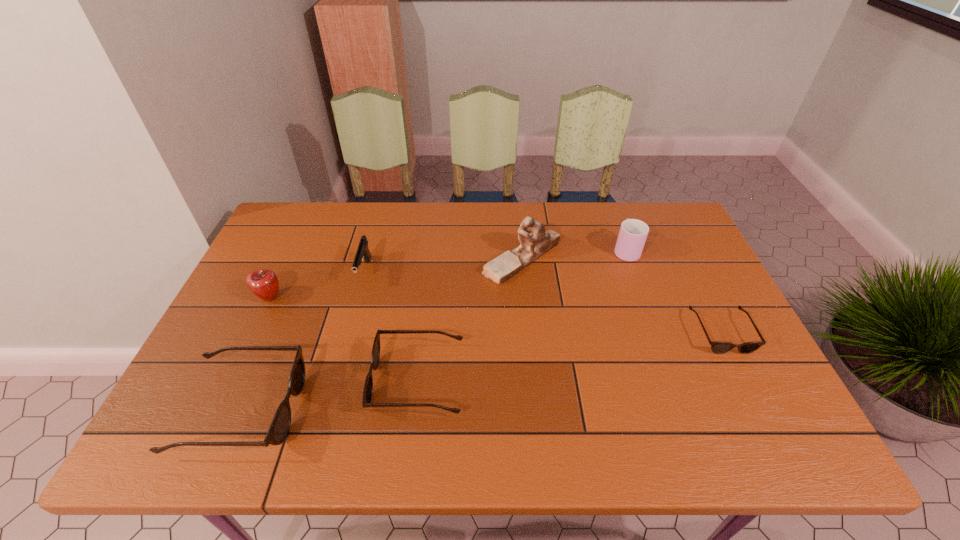
In order to click on free location located 0.150m on the front lenses of the leftmost sunglasses in this screenshot , I will do [364, 409].

Where is `free point located on the front lenses of the sixth tallest object`? free point located on the front lenses of the sixth tallest object is located at coordinates (279, 381).

You are a GUI agent. You are given a task and a screenshot of the screen. Output one action in this format:
    pyautogui.click(x=<x>, y=<y>)
    Task: Click on the free space located on the front lenses of the sixth tallest object
    
    Given the screenshot: What is the action you would take?
    pyautogui.click(x=212, y=381)

This screenshot has width=960, height=540. Identify the location of vacant space located 0.120m on the front lenses of the sixth tallest object. (323, 381).

The image size is (960, 540). What are the coordinates of `free location located 0.060m on the front lenses of the rightmost sunglasses` in the screenshot? It's located at (742, 375).

This screenshot has width=960, height=540. Identify the location of free space located 0.150m on the front-facing side of the figurine. (433, 258).

The height and width of the screenshot is (540, 960). Find the location of `free space located 0.230m on the front-facing side of the figurine`. free space located 0.230m on the front-facing side of the figurine is located at coordinates (406, 258).

The image size is (960, 540). What are the coordinates of `free location located 0.320m on the front-facing side of the figurine` in the screenshot? It's located at (377, 258).

You are a GUI agent. You are given a task and a screenshot of the screen. Output one action in this format:
    pyautogui.click(x=<x>, y=<y>)
    Task: Click on the free space located 0.200m with the handle on the side of the cup
    
    Given the screenshot: What is the action you would take?
    pyautogui.click(x=609, y=202)

The width and height of the screenshot is (960, 540). I want to click on free space located 0.200m with the handle on the side of the cup, so click(x=609, y=202).